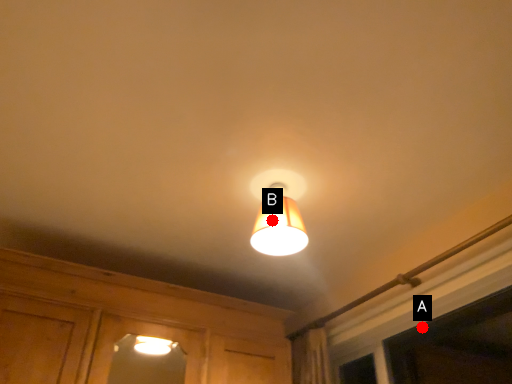
Question: Two points are circled on the image, labeled by A and B beside each circle. Which point is farther from the camera taking this photo?

Choices:
 (A) A is further
 (B) B is further

Answer: (A)